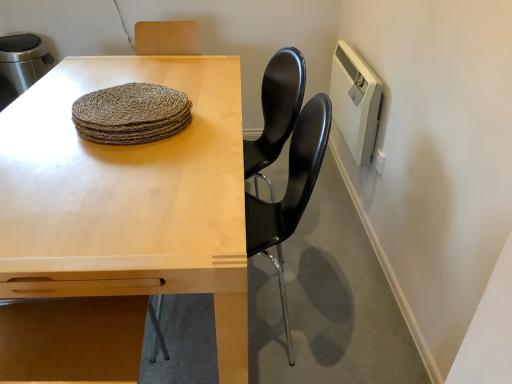
Locate an element on the screen. Image resolution: width=512 pixels, height=384 pixels. free space to the left of natural woven placemat at center is located at coordinates (41, 122).